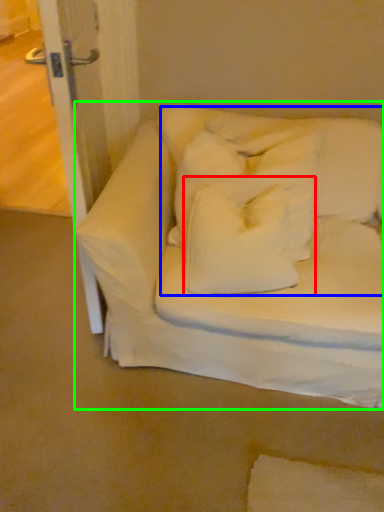
Question: Which object is positioned closest to pillow (highlighted by a red box)? Select from bedding (highlighted by a blue box) and furniture (highlighted by a green box).

Choices:
 (A) bedding
 (B) furniture

Answer: (A)